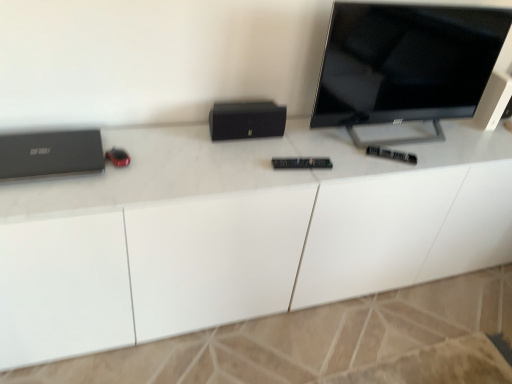
What are the coordinates of `vacant area that is situated to the right of black matte speaker at center` in the screenshot? It's located at (297, 148).